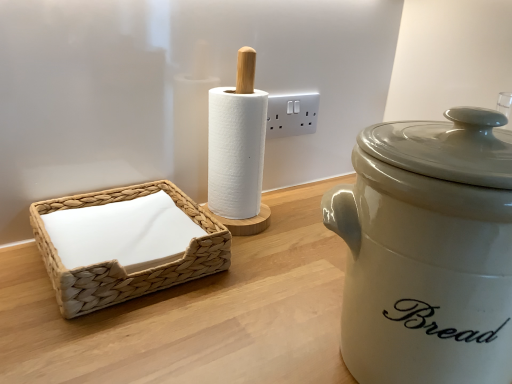
Locate an element on the screen. woven beige basket at left is located at coordinates (118, 263).

What do you see at coordinates (118, 263) in the screenshot? This screenshot has height=384, width=512. I see `woven beige basket at left` at bounding box center [118, 263].

The height and width of the screenshot is (384, 512). What do you see at coordinates (292, 114) in the screenshot?
I see `white plastic electric outlet at upper center` at bounding box center [292, 114].

Find the location of a particular element. woven beige basket at left is located at coordinates (118, 263).

Which is more to the right, woven beige basket at left or white plastic electric outlet at upper center?

white plastic electric outlet at upper center.

Considering the sizes of objects woven beige basket at left and white plastic electric outlet at upper center in the image provided, who is wider, woven beige basket at left or white plastic electric outlet at upper center?

woven beige basket at left is wider.

Is woven beige basket at left not within white plastic electric outlet at upper center?

That's correct, woven beige basket at left is outside of white plastic electric outlet at upper center.

Can you tell me how much matte white ceramic bread bin at right and woven beige basket at left differ in facing direction?

matte white ceramic bread bin at right and woven beige basket at left are facing 0.000251 degrees away from each other.

Does matte white ceramic bread bin at right touch woven beige basket at left?

matte white ceramic bread bin at right and woven beige basket at left are clearly separated.

Is woven beige basket at left located within matte white ceramic bread bin at right?

No, woven beige basket at left is located outside of matte white ceramic bread bin at right.

In terms of height, does matte white ceramic bread bin at right look taller or shorter compared to woven beige basket at left?

matte white ceramic bread bin at right is taller than woven beige basket at left.

How distant is matte white ceramic bread bin at right from white plastic electric outlet at upper center?

The distance of matte white ceramic bread bin at right from white plastic electric outlet at upper center is 18.93 inches.

From a real-world perspective, is matte white ceramic bread bin at right positioned above or below white plastic electric outlet at upper center?

In terms of real-world spatial position, matte white ceramic bread bin at right is below white plastic electric outlet at upper center.

Does point (482, 324) lie in front of point (275, 111)?

Yes, point (482, 324) is closer to viewer.

Considering the positions of objects matte white ceramic bread bin at right and white plastic electric outlet at upper center in the image provided, who is more to the left, matte white ceramic bread bin at right or white plastic electric outlet at upper center?

Positioned to the left is white plastic electric outlet at upper center.

Is there a large distance between white plastic electric outlet at upper center and matte white ceramic bread bin at right?

They are positioned close to each other.

Considering the positions of points (312, 108) and (476, 270), is point (312, 108) closer to camera compared to point (476, 270)?

No, it is not.

How far apart are white plastic electric outlet at upper center and matte white ceramic bread bin at right?

white plastic electric outlet at upper center is 18.93 inches from matte white ceramic bread bin at right.

From the image's perspective, which is below, white plastic electric outlet at upper center or matte white ceramic bread bin at right?

From the image's view, matte white ceramic bread bin at right is below.

Is white plastic electric outlet at upper center next to woven beige basket at left?

There is a gap between white plastic electric outlet at upper center and woven beige basket at left.

Can you confirm if white plastic electric outlet at upper center is positioned to the left of woven beige basket at left?

In fact, white plastic electric outlet at upper center is to the right of woven beige basket at left.

Could you tell me if white plastic electric outlet at upper center is turned towards woven beige basket at left?

No, white plastic electric outlet at upper center does not turn towards woven beige basket at left.

Is point (227, 239) closer or farther from the camera than point (356, 157)?

Clearly, point (227, 239) is more distant from the camera than point (356, 157).

Is woven beige basket at left positioned beyond the bounds of matte white ceramic bread bin at right?

Yes, woven beige basket at left is located beyond the bounds of matte white ceramic bread bin at right.

Which is more to the left, woven beige basket at left or matte white ceramic bread bin at right?

Positioned to the left is woven beige basket at left.

From a real-world perspective, between woven beige basket at left and matte white ceramic bread bin at right, who is vertically lower?

In real-world perspective, woven beige basket at left is lower.

This screenshot has width=512, height=384. I want to click on electric outlet on the right of woven beige basket at left, so click(292, 114).

What are the coordinates of `basket below the matte white ceramic bread bin at right (from a real-world perspective)` in the screenshot? It's located at (118, 263).

Which object lies further to the anchor point white plastic electric outlet at upper center, woven beige basket at left or matte white ceramic bread bin at right?

The object further to white plastic electric outlet at upper center is matte white ceramic bread bin at right.

Estimate the real-world distances between objects in this image. Which object is closer to white plastic electric outlet at upper center, matte white ceramic bread bin at right or woven beige basket at left?

woven beige basket at left is closer to white plastic electric outlet at upper center.

Looking at the image, which one is located closer to matte white ceramic bread bin at right, white plastic electric outlet at upper center or woven beige basket at left?

woven beige basket at left is closer to matte white ceramic bread bin at right.

Looking at the image, which one is located further to woven beige basket at left, white plastic electric outlet at upper center or matte white ceramic bread bin at right?

Based on the image, white plastic electric outlet at upper center appears to be further to woven beige basket at left.

From the image, which object appears to be farther from woven beige basket at left, matte white ceramic bread bin at right or white plastic electric outlet at upper center?

white plastic electric outlet at upper center is positioned further to the anchor woven beige basket at left.

Considering their positions, is woven beige basket at left positioned further to matte white ceramic bread bin at right than white plastic electric outlet at upper center?

white plastic electric outlet at upper center.

At what (x,y) coordinates should I click in order to perform the action: click on basket between matte white ceramic bread bin at right and white plastic electric outlet at upper center from front to back. Please return your answer as a coordinate pair (x, y). This screenshot has width=512, height=384. Looking at the image, I should click on (118, 263).